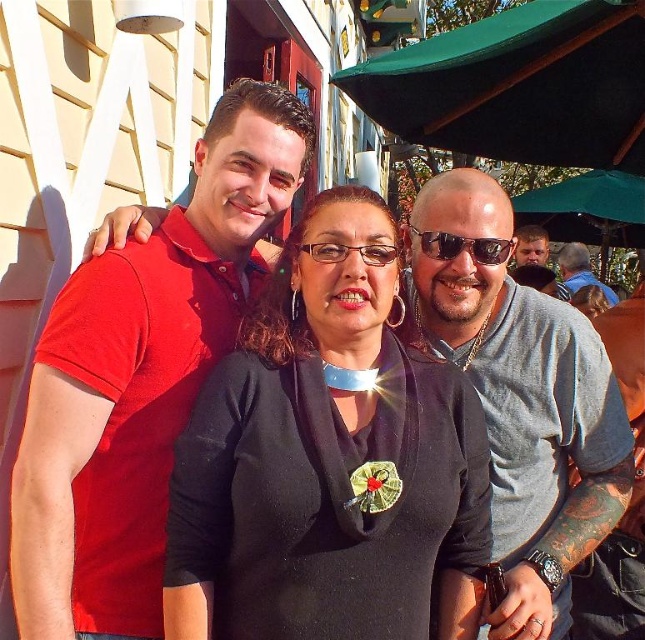
You are a bartender at the outdoor cafe. You see the transparent plastic glasses at center and the black leather jacket at center. Which item is placed on top of the other?

The transparent plastic glasses at center is positioned over black leather jacket at center, so the transparent plastic glasses at center is placed on top of the black leather jacket at center.

You are standing at the point marked by coordinates [141,378] in the image. What is the nearest object to you?

The point marked by coordinates [141,378] is nearest to the matte red polo shirt at left.

You are standing at the point with coordinates point (392, 472). You want to walk towards the point with coordinates point (259, 403). Will you be moving forward or backward relative to your current position?

Since point (259, 403) is behind point (392, 472), moving towards it would mean you are moving backward relative to your current position at point (392, 472).